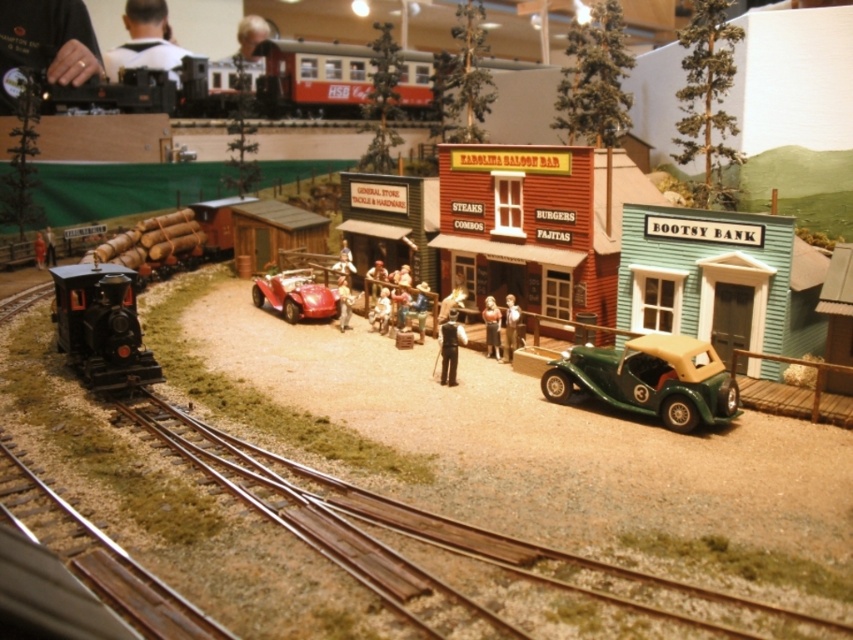
Question: Which of the following is the closest to the observer?

Choices:
 (A) shiny red car at center
 (B) green matte toy car at center

Answer: (B)

Question: Which of the following is the farthest from the observer?

Choices:
 (A) shiny red car at center
 (B) brushed metal train at upper center
 (C) green matte toy car at center

Answer: (B)

Question: Is green matte toy car at center below shiny red car at center?

Choices:
 (A) no
 (B) yes

Answer: (B)

Question: In this image, where is brushed metal train at upper center located relative to shiny red car at center?

Choices:
 (A) right
 (B) left

Answer: (B)

Question: Estimate the real-world distances between objects in this image. Which object is farther from the green matte toy car at center?

Choices:
 (A) shiny red car at center
 (B) brushed metal train at upper center

Answer: (B)

Question: Is brushed metal train at upper center smaller than shiny red car at center?

Choices:
 (A) yes
 (B) no

Answer: (B)